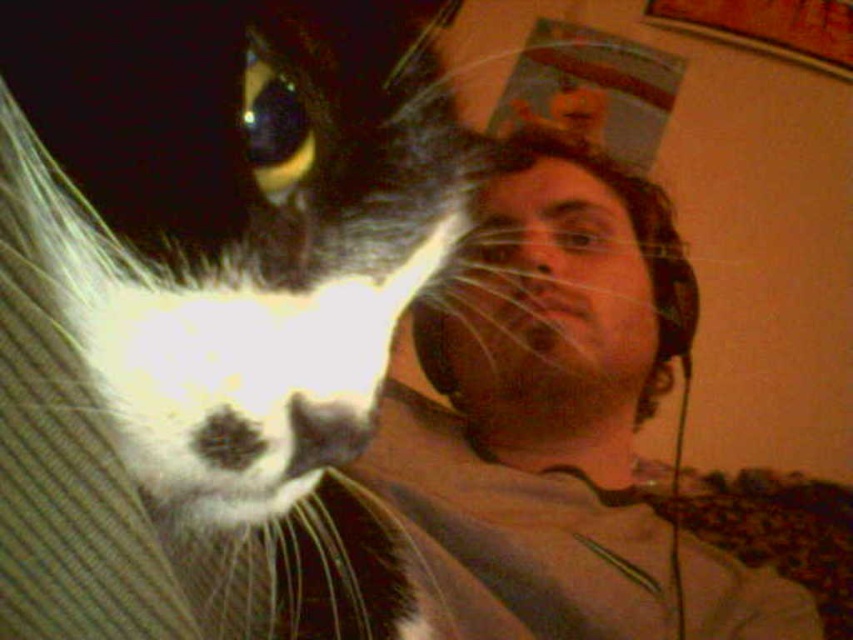
Between matte gray shirt at center and matte black headphones at upper right, which one appears on the left side from the viewer's perspective?

Positioned to the left is matte gray shirt at center.

Which is behind, point (422, 576) or point (561, 156)?

Positioned behind is point (561, 156).

Identify the location of matte gray shirt at center. (558, 420).

In the scene shown: Can you confirm if black and white fur cat at left is thinner than matte gray shirt at center?

Indeed, black and white fur cat at left has a lesser width compared to matte gray shirt at center.

Is black and white fur cat at left taller than matte gray shirt at center?

No.

At what (x,y) coordinates should I click in order to perform the action: click on black and white fur cat at left. Please return your answer as a coordinate pair (x, y). This screenshot has width=853, height=640. Looking at the image, I should click on (221, 349).

The image size is (853, 640). I want to click on black and white fur cat at left, so click(x=221, y=349).

Does black and white fur cat at left appear on the left side of matte black headphones at upper right?

Indeed, black and white fur cat at left is positioned on the left side of matte black headphones at upper right.

The height and width of the screenshot is (640, 853). In order to click on black and white fur cat at left in this screenshot , I will do `click(221, 349)`.